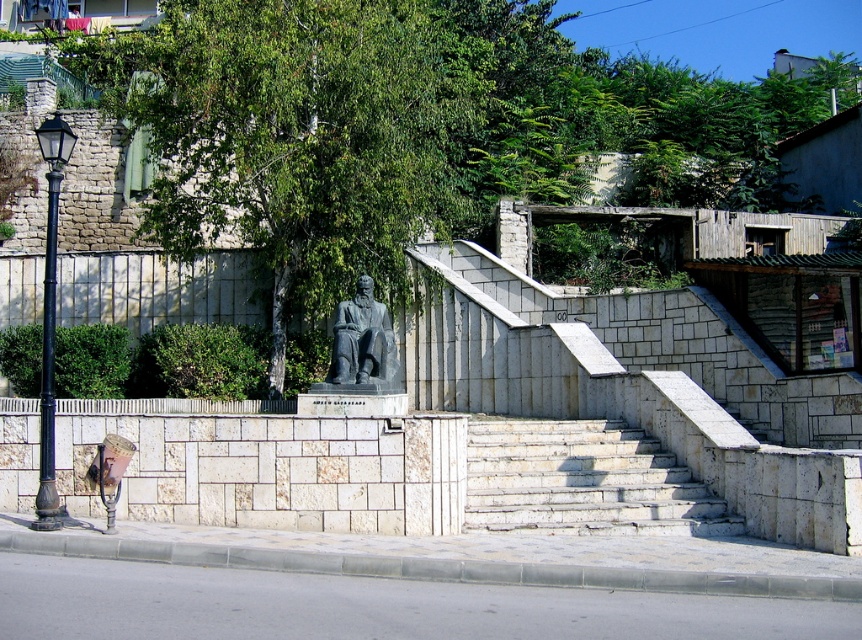
Where is `green leafy tree at center`? The image size is (862, 640). green leafy tree at center is located at coordinates (417, 128).

Which is more to the left, green leafy tree at center or gray stone statue at center?

From the viewer's perspective, gray stone statue at center appears more on the left side.

Between point (504, 148) and point (336, 372), which one is positioned in front?

Positioned in front is point (336, 372).

Find the location of a particular element. The image size is (862, 640). green leafy tree at center is located at coordinates (417, 128).

Can you confirm if white stone stairs at center is wider than gray stone statue at center?

Indeed, white stone stairs at center has a greater width compared to gray stone statue at center.

Does point (706, 500) come farther from viewer compared to point (328, 384)?

No, it is not.

Is point (542, 426) positioned behind point (366, 316)?

Yes, point (542, 426) is farther from viewer.

The width and height of the screenshot is (862, 640). In order to click on white stone stairs at center in this screenshot , I will do [x=583, y=481].

Between green leafy tree at center and white stone stairs at center, which one is positioned higher?

green leafy tree at center

Does green leafy tree at center come in front of white stone stairs at center?

No, it is not.

Locate an element on the screen. green leafy tree at center is located at coordinates (417, 128).